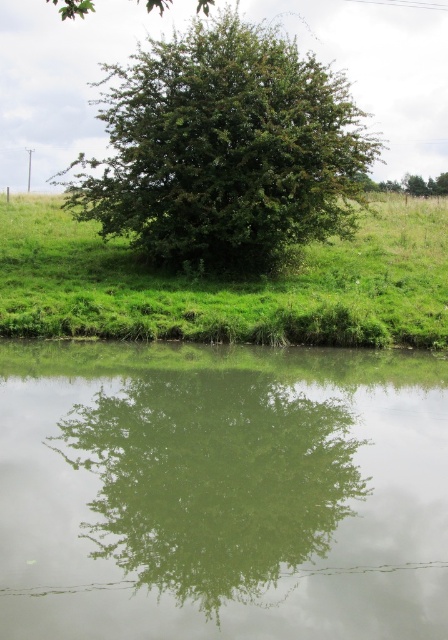
Looking at this image, is green reflective water at center to the right of green leafy tree at center from the viewer's perspective?

Indeed, green reflective water at center is positioned on the right side of green leafy tree at center.

Does point (274, 612) lie behind point (121, 122)?

No, it is in front of (121, 122).

Who is more distant from viewer, (x=370, y=451) or (x=292, y=173)?

The point (x=292, y=173) is more distant.

Image resolution: width=448 pixels, height=640 pixels. In order to click on green reflective water at center in this screenshot , I will do `click(222, 492)`.

Who is taller, green reflective water at center or green grassy at center?

green grassy at center is taller.

Locate an element on the screen. The width and height of the screenshot is (448, 640). green reflective water at center is located at coordinates (222, 492).

Identify the location of green reflective water at center. Image resolution: width=448 pixels, height=640 pixels. [222, 492].

Is green leafy tree at center bigger than green grassy at center?

Indeed, green leafy tree at center has a larger size compared to green grassy at center.

Who is lower down, green leafy tree at center or green grassy at center?

green grassy at center is below.

The height and width of the screenshot is (640, 448). Describe the element at coordinates (224, 150) in the screenshot. I see `green leafy tree at center` at that location.

This screenshot has height=640, width=448. In order to click on green leafy tree at center in this screenshot , I will do `click(224, 150)`.